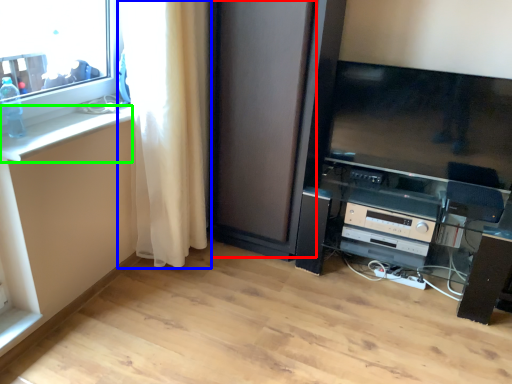
Question: Considering the real-world distances, which object is farthest from screen door (highlighted by a red box)? curtain (highlighted by a blue box) or counter top (highlighted by a green box)?

Choices:
 (A) curtain
 (B) counter top

Answer: (B)